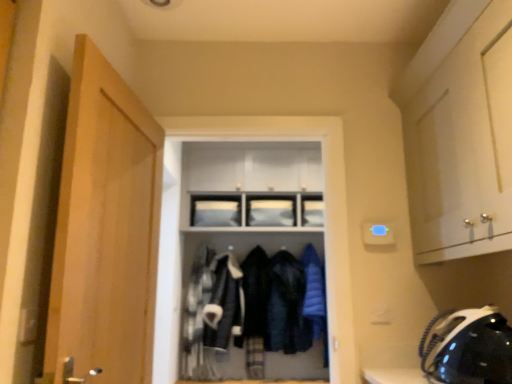
Question: From the image's perspective, does white glossy cabinet at upper right, which appears as the 2th cabinetry when viewed from the left, appear higher than black matte helmet at lower right?

Choices:
 (A) no
 (B) yes

Answer: (B)

Question: Can you confirm if white glossy cabinet at upper right, which ranks as the first cabinetry in front-to-back order, is wider than black matte helmet at lower right?

Choices:
 (A) no
 (B) yes

Answer: (A)

Question: From a real-world perspective, is white glossy cabinet at upper right, which appears as the 2th cabinetry when viewed from the left, over black matte helmet at lower right?

Choices:
 (A) no
 (B) yes

Answer: (B)

Question: Considering the relative sizes of white glossy cabinet at upper right, the 1th cabinetry from the right, and black matte helmet at lower right in the image provided, is white glossy cabinet at upper right, the 1th cabinetry from the right, smaller than black matte helmet at lower right?

Choices:
 (A) no
 (B) yes

Answer: (A)

Question: Is white glossy cabinet at upper right, the 1th cabinetry from the right, positioned far away from black matte helmet at lower right?

Choices:
 (A) no
 (B) yes

Answer: (A)

Question: Is matte black coat rack at center wider or thinner than matte white cabinet at upper center, acting as the 2th cabinetry starting from the right?

Choices:
 (A) wide
 (B) thin

Answer: (A)

Question: From a real-world perspective, is matte black coat rack at center physically located above or below matte white cabinet at upper center, the 1th cabinetry positioned from the left?

Choices:
 (A) below
 (B) above

Answer: (A)

Question: Considering their positions, is matte black coat rack at center located in front of or behind matte white cabinet at upper center, the second cabinetry in the front-to-back sequence?

Choices:
 (A) behind
 (B) front

Answer: (B)

Question: Is matte black coat rack at center taller or shorter than matte white cabinet at upper center, acting as the 2th cabinetry starting from the right?

Choices:
 (A) tall
 (B) short

Answer: (A)

Question: Based on their sizes in the image, would you say wooden door at left is bigger or smaller than velvet-like black coat at center, placed as the second clothing when sorted from right to left?

Choices:
 (A) big
 (B) small

Answer: (A)

Question: Is wooden door at left in front of or behind velvet-like black coat at center, arranged as the second clothing when viewed from the left, in the image?

Choices:
 (A) behind
 (B) front

Answer: (B)

Question: From their relative heights in the image, would you say wooden door at left is taller or shorter than velvet-like black coat at center, arranged as the second clothing when viewed from the left?

Choices:
 (A) tall
 (B) short

Answer: (A)

Question: From the image's perspective, is wooden door at left above or below velvet-like black coat at center, arranged as the second clothing when viewed from the left?

Choices:
 (A) below
 (B) above

Answer: (B)

Question: Which is correct: matte black coat rack at center is inside blue down jacket at center, or outside of it?

Choices:
 (A) outside
 (B) inside

Answer: (A)

Question: Relative to blue down jacket at center, is matte black coat rack at center in front or behind?

Choices:
 (A) behind
 (B) front

Answer: (B)